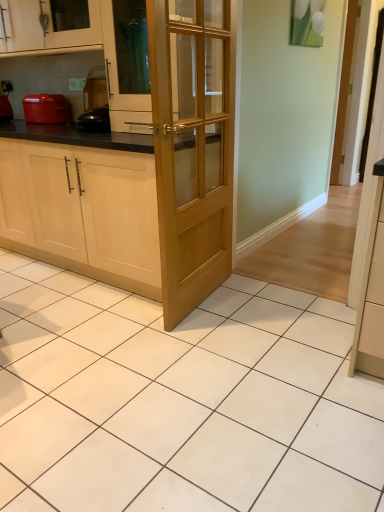
Question: Considering the relative sizes of matte wood cabinet at upper left, which is counted as the 2th cabinetry, starting from the bottom, and matte red pot at left in the image provided, is matte wood cabinet at upper left, which is counted as the 2th cabinetry, starting from the bottom, bigger than matte red pot at left?

Choices:
 (A) yes
 (B) no

Answer: (A)

Question: Is matte wood cabinet at upper left, the first cabinetry when ordered from top to bottom, thinner than matte red pot at left?

Choices:
 (A) yes
 (B) no

Answer: (B)

Question: Is matte wood cabinet at upper left, which is counted as the 2th cabinetry, starting from the bottom, at the left side of matte red pot at left?

Choices:
 (A) no
 (B) yes

Answer: (A)

Question: Is matte wood cabinet at upper left, the first cabinetry when ordered from top to bottom, in front of matte red pot at left?

Choices:
 (A) yes
 (B) no

Answer: (A)

Question: From a real-world perspective, does matte wood cabinet at upper left, which is counted as the 2th cabinetry, starting from the bottom, stand above matte red pot at left?

Choices:
 (A) no
 (B) yes

Answer: (B)

Question: Is matte wood cabinet at upper left, which is counted as the 2th cabinetry, starting from the bottom, wider or thinner than light brown wooden door at center?

Choices:
 (A) wide
 (B) thin

Answer: (A)

Question: Is point pyautogui.click(x=59, y=31) closer or farther from the camera than point pyautogui.click(x=187, y=52)?

Choices:
 (A) farther
 (B) closer

Answer: (A)

Question: Is matte wood cabinet at upper left, which is counted as the 2th cabinetry, starting from the bottom, bigger or smaller than light brown wooden door at center?

Choices:
 (A) big
 (B) small

Answer: (A)

Question: Which is correct: matte wood cabinet at upper left, which is counted as the 2th cabinetry, starting from the bottom, is inside light brown wooden door at center, or outside of it?

Choices:
 (A) inside
 (B) outside

Answer: (B)

Question: Relative to matte red pot at left, is light brown wooden door at center in front or behind?

Choices:
 (A) behind
 (B) front

Answer: (B)

Question: Does point (158, 6) appear closer or farther from the camera than point (54, 104)?

Choices:
 (A) farther
 (B) closer

Answer: (B)

Question: Visually, is light brown wooden door at center positioned to the left or to the right of matte red pot at left?

Choices:
 (A) left
 (B) right

Answer: (B)

Question: Is light brown wooden door at center inside the boundaries of matte red pot at left, or outside?

Choices:
 (A) inside
 (B) outside

Answer: (B)

Question: Considering the positions of point (180, 36) and point (3, 119), is point (180, 36) closer or farther from the camera than point (3, 119)?

Choices:
 (A) farther
 (B) closer

Answer: (B)

Question: Would you say light brown wooden door at center is inside or outside matte red pot at left?

Choices:
 (A) inside
 (B) outside

Answer: (B)